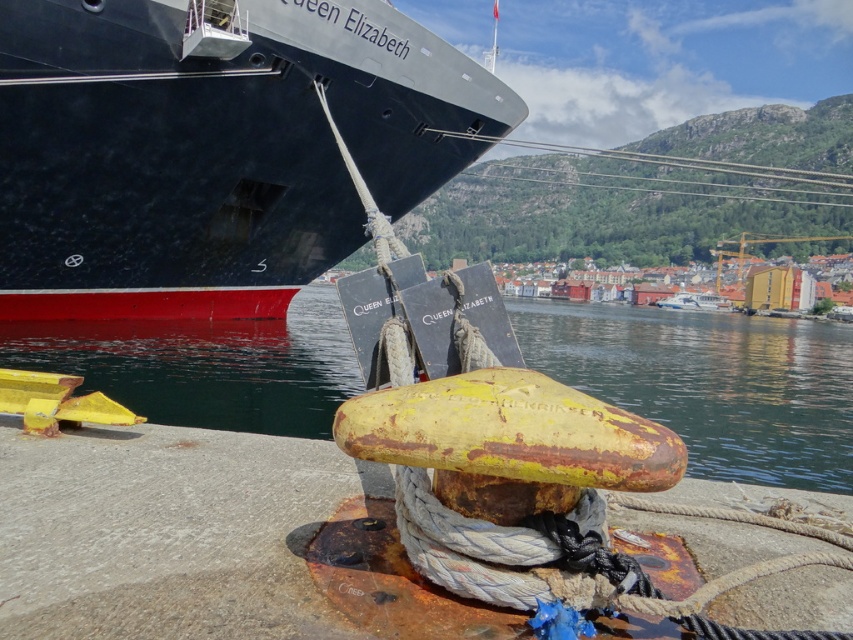
Question: Is shiny black ship at upper left closer to camera compared to yellow rusty water at lower center?

Choices:
 (A) yes
 (B) no

Answer: (B)

Question: Can you confirm if shiny black ship at upper left is wider than yellow rusty water at lower center?

Choices:
 (A) no
 (B) yes

Answer: (A)

Question: Among these points, which one is farthest from the camera?

Choices:
 (A) (654, 314)
 (B) (86, 285)

Answer: (A)

Question: Among these objects, which one is nearest to the camera?

Choices:
 (A) yellow rusty water at lower center
 (B) shiny black ship at upper left

Answer: (A)

Question: From the image, what is the correct spatial relationship of shiny black ship at upper left in relation to yellow rusty water at lower center?

Choices:
 (A) right
 (B) left

Answer: (B)